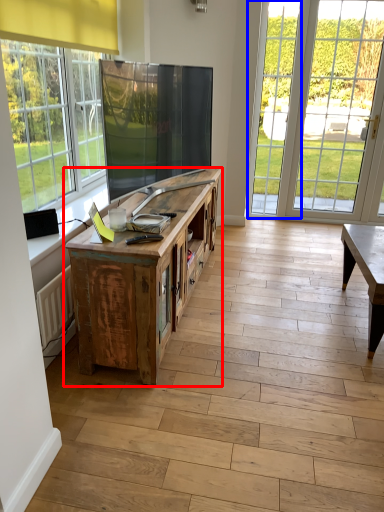
Question: Which object appears closest to the camera in this image, cabinetry (highlighted by a red box) or glass door (highlighted by a blue box)?

Choices:
 (A) cabinetry
 (B) glass door

Answer: (A)